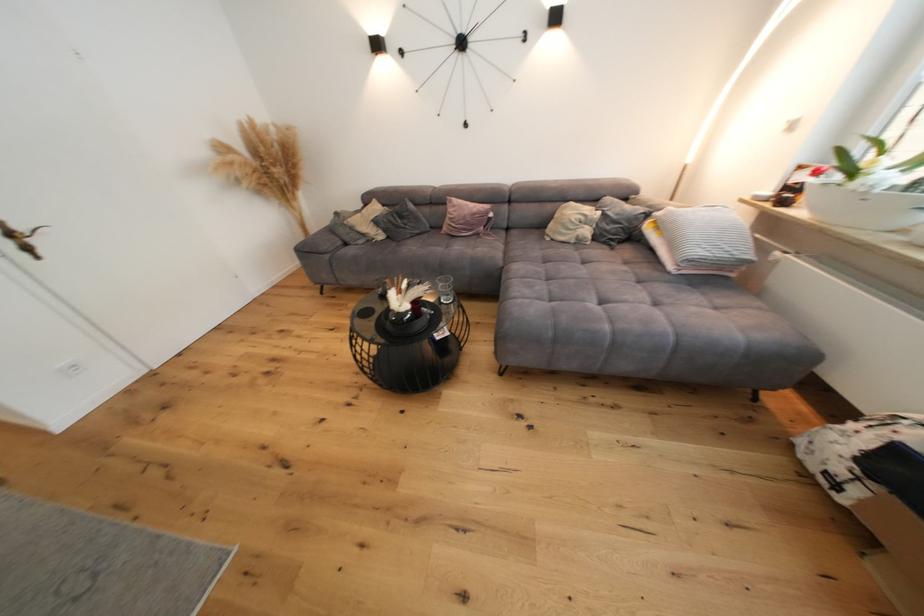
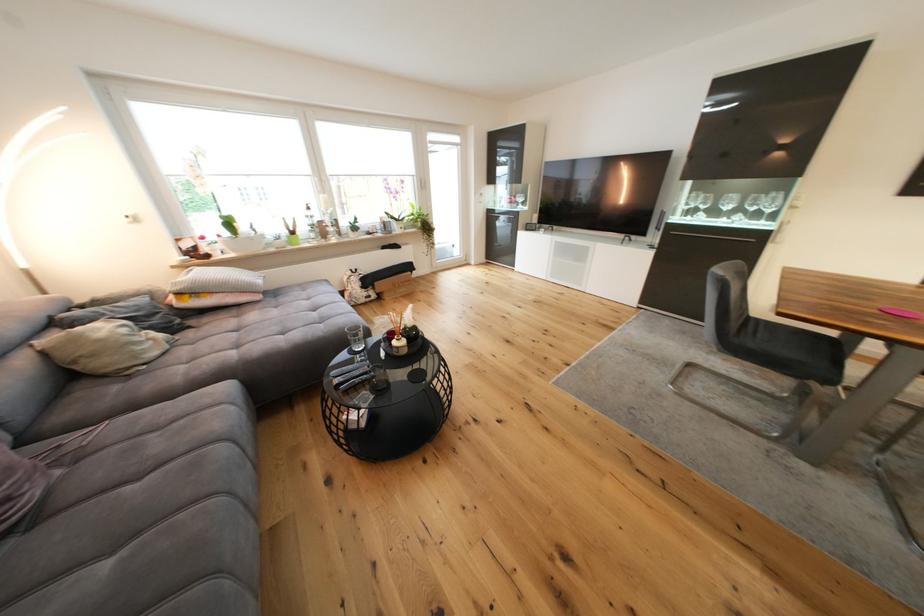
In the second image, find the point that corresponds to point (586, 244) in the first image.

(178, 345)